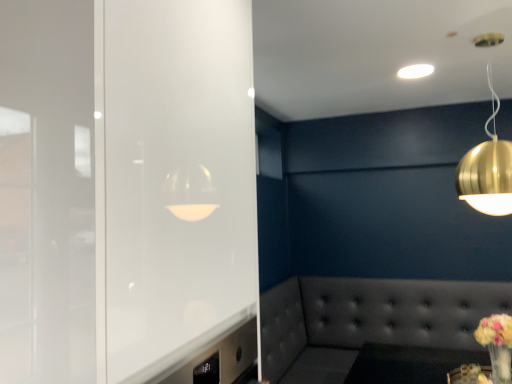
Question: From a real-world perspective, is tufted leather couch at lower right physically located above or below white glossy ceiling light at upper center, positioned as the second lamp in front-to-back order?

Choices:
 (A) above
 (B) below

Answer: (B)

Question: From the image's perspective, is tufted leather couch at lower right above or below white glossy ceiling light at upper center, the 2th lamp in the bottom-to-top sequence?

Choices:
 (A) above
 (B) below

Answer: (B)

Question: Which object is positioned farthest from the white glossy ceiling light at upper center, positioned as the second lamp in front-to-back order?

Choices:
 (A) frosted glass door at left
 (B) gold metallic sphere at upper right, the first lamp in the bottom-to-top sequence
 (C) tufted leather couch at lower right
 (D) pastel yellow bouquet at lower right

Answer: (C)

Question: Estimate the real-world distances between objects in this image. Which object is farther from the tufted leather couch at lower right?

Choices:
 (A) white glossy ceiling light at upper center, positioned as the second lamp in front-to-back order
 (B) frosted glass door at left
 (C) pastel yellow bouquet at lower right
 (D) gold metallic sphere at upper right, the first lamp in the bottom-to-top sequence

Answer: (B)